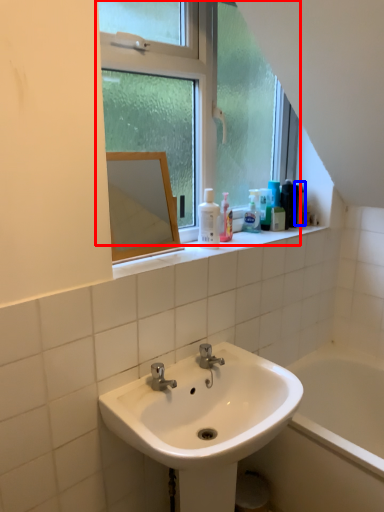
Question: Among these objects, which one is farthest to the camera, window (highlighted by a red box) or mouthwash (highlighted by a blue box)?

Choices:
 (A) window
 (B) mouthwash

Answer: (B)